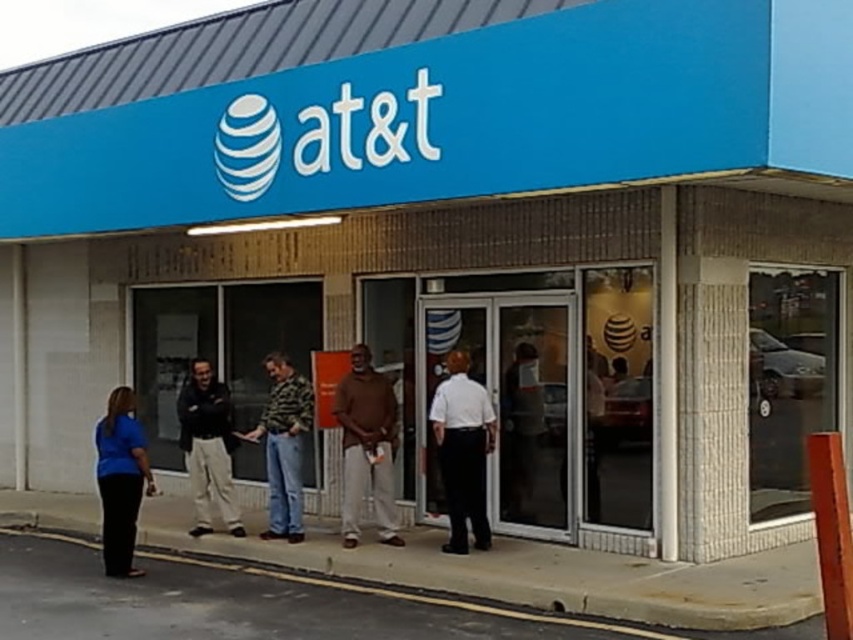
Does dark gray sweater at center come behind black pants at lower left?

Yes, dark gray sweater at center is further from the viewer.

Can you confirm if dark gray sweater at center is thinner than black pants at lower left?

Correct, dark gray sweater at center's width is less than black pants at lower left's.

Between point (215, 428) and point (228, 563), which one is positioned behind?

The point (215, 428) is more distant.

Where is `dark gray sweater at center`? dark gray sweater at center is located at coordinates (207, 445).

Describe the element at coordinates (463, 451) in the screenshot. I see `white shirt at center` at that location.

Who is more distant from viewer, (x=450, y=385) or (x=212, y=403)?

Positioned behind is point (x=212, y=403).

Is point (461, 416) positioned after point (184, 381)?

No, it is in front of (184, 381).

Where is `white shirt at center`? white shirt at center is located at coordinates (463, 451).

Identify the location of brown cotton shirt at center. (366, 445).

Does brown cotton shirt at center have a lesser width compared to white shirt at center?

No.

What do you see at coordinates (366, 445) in the screenshot? The height and width of the screenshot is (640, 853). I see `brown cotton shirt at center` at bounding box center [366, 445].

Find the location of a particular element. This screenshot has width=853, height=640. brown cotton shirt at center is located at coordinates (366, 445).